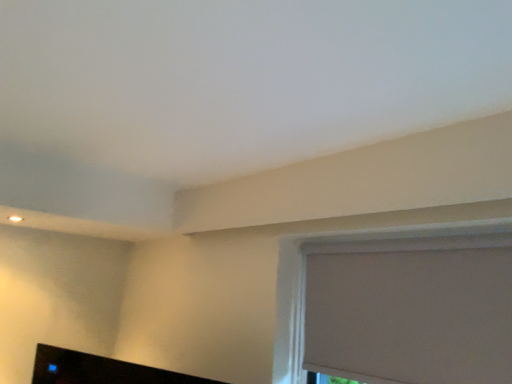
Looking at this image, what is the approximate height of white fabric window at upper right?

The height of white fabric window at upper right is 60.62 centimeters.

The image size is (512, 384). I want to click on white fabric window at upper right, so click(356, 251).

What do you see at coordinates (356, 251) in the screenshot?
I see `white fabric window at upper right` at bounding box center [356, 251].

What is the approximate width of white fabric window at upper right?

The width of white fabric window at upper right is 2.64 inches.

The width and height of the screenshot is (512, 384). In order to click on white fabric window at upper right in this screenshot , I will do `click(356, 251)`.